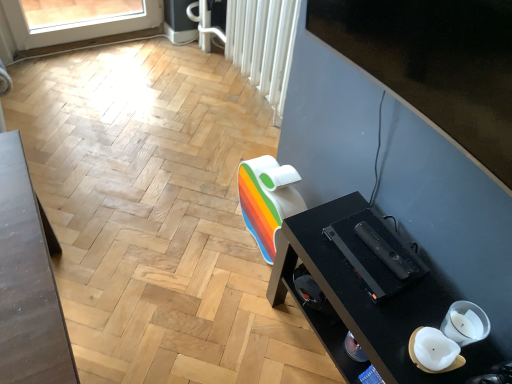
Question: Does white textured radiator at upper center have a greater width compared to black glossy tv at upper right?

Choices:
 (A) no
 (B) yes

Answer: (A)

Question: Is the surface of white textured radiator at upper center in direct contact with black glossy tv at upper right?

Choices:
 (A) yes
 (B) no

Answer: (B)

Question: Does white textured radiator at upper center turn towards black glossy tv at upper right?

Choices:
 (A) no
 (B) yes

Answer: (A)

Question: Considering the relative sizes of white textured radiator at upper center and black glossy tv at upper right in the image provided, is white textured radiator at upper center thinner than black glossy tv at upper right?

Choices:
 (A) yes
 (B) no

Answer: (A)

Question: From a real-world perspective, is white textured radiator at upper center located higher than black glossy tv at upper right?

Choices:
 (A) yes
 (B) no

Answer: (B)

Question: Is white textured radiator at upper center smaller than black glossy tv at upper right?

Choices:
 (A) no
 (B) yes

Answer: (A)

Question: Is white textured radiator at upper center shorter than black glossy desk at lower right?

Choices:
 (A) no
 (B) yes

Answer: (A)

Question: Is white textured radiator at upper center oriented towards black glossy desk at lower right?

Choices:
 (A) yes
 (B) no

Answer: (B)

Question: Does white textured radiator at upper center come in front of black glossy desk at lower right?

Choices:
 (A) yes
 (B) no

Answer: (B)

Question: Is white textured radiator at upper center further to the viewer compared to black glossy desk at lower right?

Choices:
 (A) yes
 (B) no

Answer: (A)

Question: Is black glossy desk at lower right at the back of white textured radiator at upper center?

Choices:
 (A) no
 (B) yes

Answer: (A)

Question: Is black glossy desk at lower right located within white textured radiator at upper center?

Choices:
 (A) no
 (B) yes

Answer: (A)

Question: Is there a large distance between black glossy desk at lower right and white textured radiator at upper center?

Choices:
 (A) yes
 (B) no

Answer: (B)